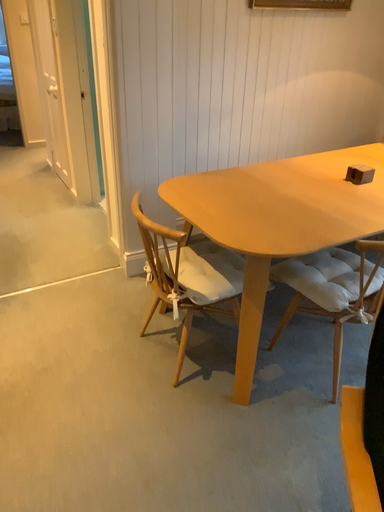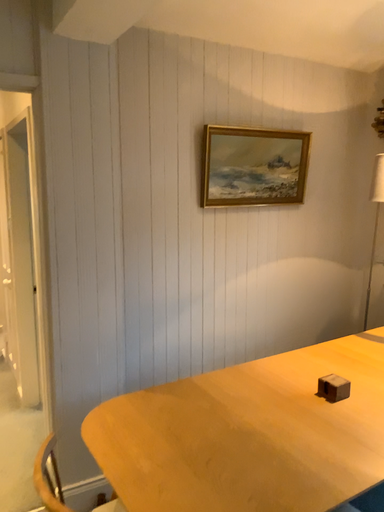
Question: Which way did the camera rotate in the video?

Choices:
 (A) rotated downward
 (B) rotated upward

Answer: (B)